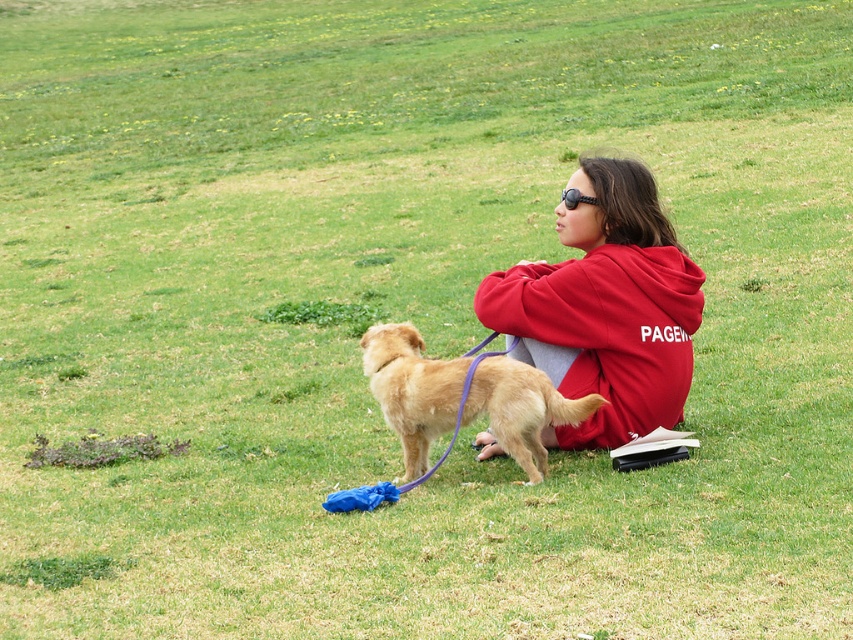
Is red fleece sweatshirt at center to the left of golden fur dog at center from the viewer's perspective?

Incorrect, red fleece sweatshirt at center is not on the left side of golden fur dog at center.

Is red fleece sweatshirt at center to the right of golden fur dog at center from the viewer's perspective?

Indeed, red fleece sweatshirt at center is positioned on the right side of golden fur dog at center.

The height and width of the screenshot is (640, 853). What do you see at coordinates (605, 307) in the screenshot? I see `red fleece sweatshirt at center` at bounding box center [605, 307].

I want to click on red fleece sweatshirt at center, so click(605, 307).